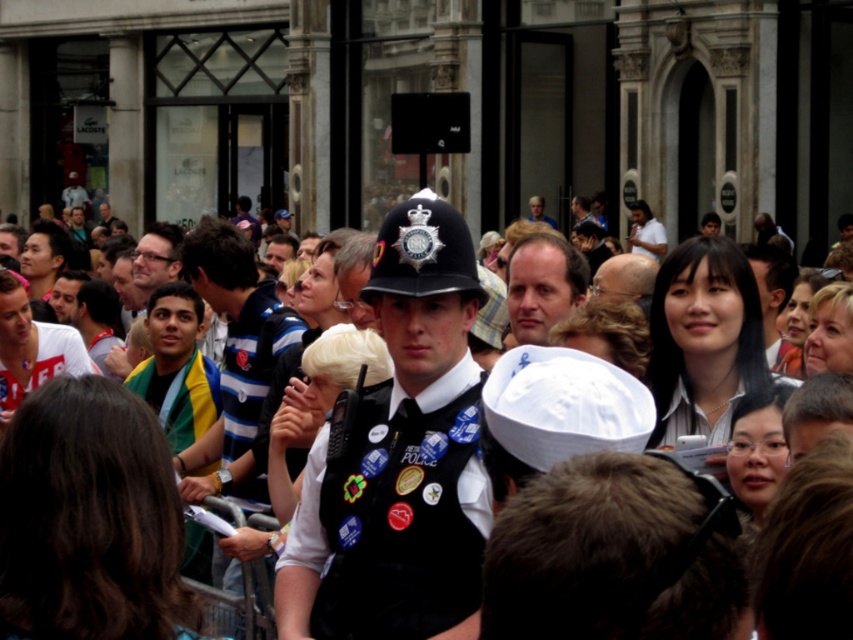
Between point (386, 445) and point (550, 323), which one is positioned in front?

Point (386, 445) is in front.

Can you confirm if black uniform at center is taller than light brown hair at center?

Yes, black uniform at center is taller than light brown hair at center.

Is point (367, 557) positioned after point (550, 236)?

No, it is not.

At what (x,y) coordinates should I click in order to perform the action: click on black uniform at center. Please return your answer as a coordinate pair (x, y). This screenshot has width=853, height=640. Looking at the image, I should click on (399, 458).